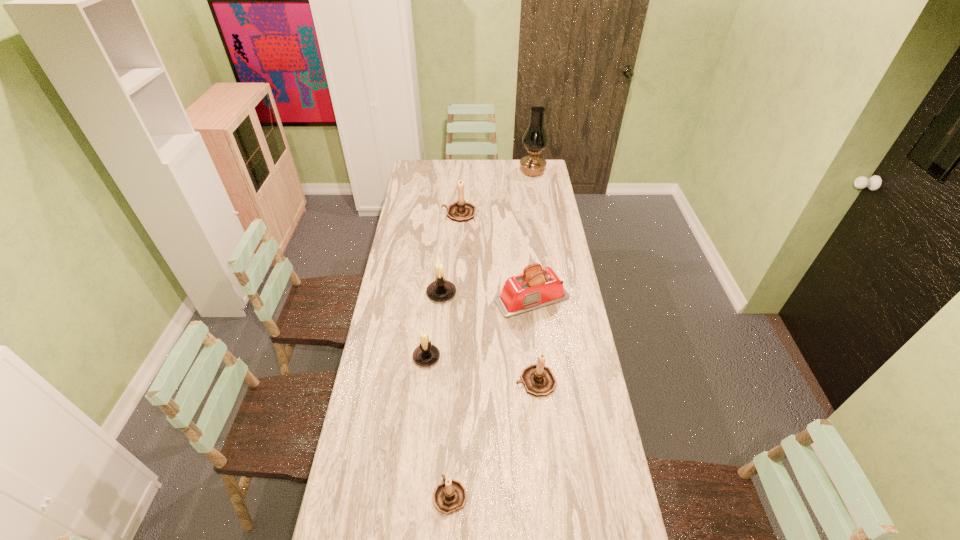
The width and height of the screenshot is (960, 540). I want to click on the nearest brown candle holder, so click(450, 496).

Locate an element on the screen. The image size is (960, 540). the smallest brown candle holder is located at coordinates (450, 496).

At what (x,y) coordinates should I click in order to perform the action: click on vacant position located on the left of the farthest object. Please return your answer as a coordinate pair (x, y). The image size is (960, 540). Looking at the image, I should click on (492, 172).

Find the location of a particular element. This screenshot has height=540, width=960. free space located on the front of the farthest brown candle holder is located at coordinates (457, 246).

Find the location of `free point located 0.120m on the back of the bigger white candle holder`. free point located 0.120m on the back of the bigger white candle holder is located at coordinates (444, 265).

In order to click on vacant space located 0.290m on the back of the red toaster in this screenshot , I will do `click(525, 241)`.

Image resolution: width=960 pixels, height=540 pixels. I want to click on vacant space located on the front of the smaller white candle holder, so click(423, 387).

Image resolution: width=960 pixels, height=540 pixels. Identify the location of vacant area situated 0.340m on the left of the rightmost brown candle holder. (423, 381).

Where is `vacant space located 0.080m on the right of the smallest brown candle holder`? This screenshot has height=540, width=960. vacant space located 0.080m on the right of the smallest brown candle holder is located at coordinates (493, 495).

This screenshot has height=540, width=960. I want to click on object that is at the far edge, so click(535, 139).